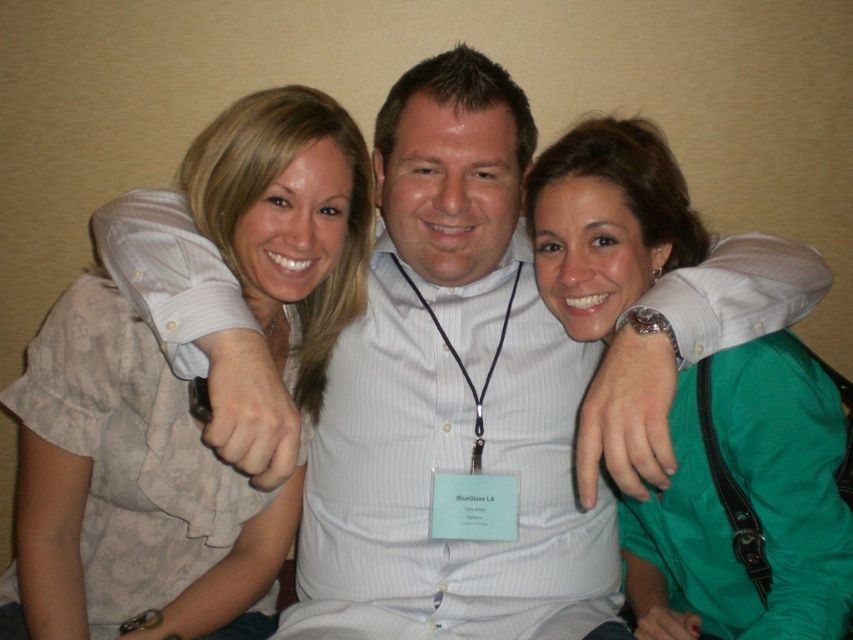
Question: Does white striped shirt at center have a smaller size compared to light beige blouse at center?

Choices:
 (A) no
 (B) yes

Answer: (B)

Question: Based on their relative distances, which object is farther from the green satin blouse at center?

Choices:
 (A) white striped shirt at center
 (B) light beige blouse at center

Answer: (B)

Question: Observing the image, what is the correct spatial positioning of white striped shirt at center in reference to green satin blouse at center?

Choices:
 (A) right
 (B) left

Answer: (B)

Question: Which of the following is the farthest from the observer?

Choices:
 (A) white striped shirt at center
 (B) green satin blouse at center
 (C) light beige blouse at center

Answer: (A)

Question: Can you confirm if white striped shirt at center is positioned to the right of green satin blouse at center?

Choices:
 (A) yes
 (B) no

Answer: (B)

Question: Which object is positioned closest to the green satin blouse at center?

Choices:
 (A) white striped shirt at center
 (B) light beige blouse at center

Answer: (A)